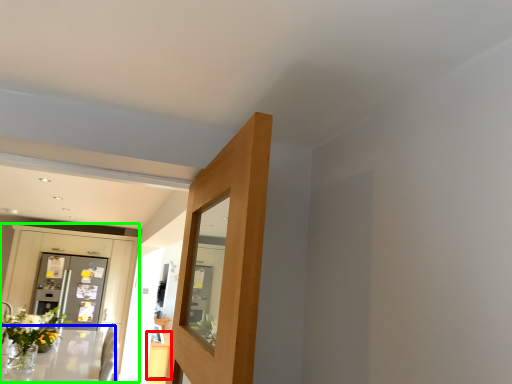
Question: Based on their relative distances, which object is nearer to table (highlighted by a red box)? Choose from table (highlighted by a blue box) and dresser (highlighted by a green box).

Choices:
 (A) table
 (B) dresser

Answer: (A)